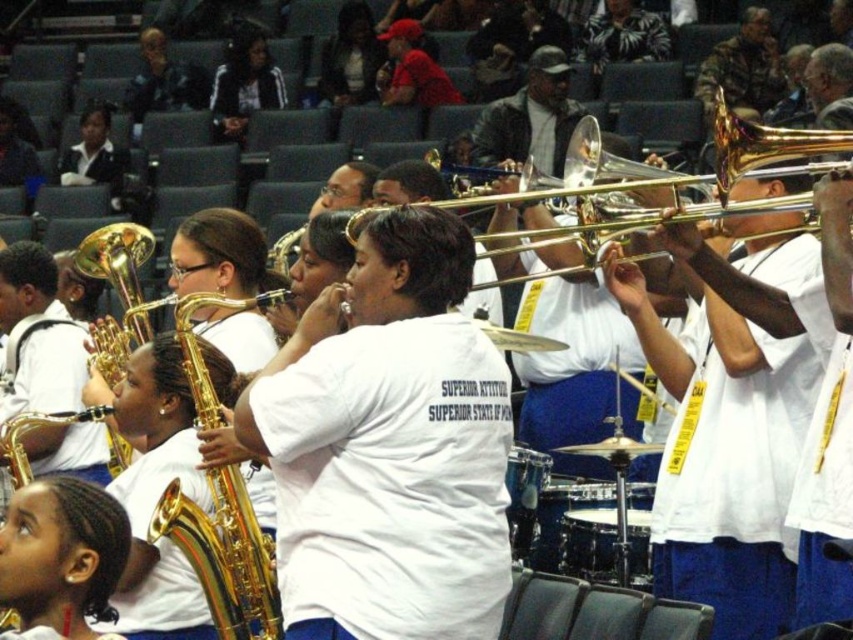
You are a photographer standing at the front of the stage where the school band is performing. You want to take a photo of the black jacket at upper left and the golden saxophone at lower right. How far apart are these two objects in the image?

The black jacket at upper left and the golden saxophone at lower right are 58.68 meters apart.

You are a photographer standing at the front of the stage where the school band is performing. You want to take a photo that includes both the point at coordinates point [202,538] and point [263,76]. Which of these points will appear closer to you in the final photo?

Point [202,538] is closer to the viewer than point [263,76], so it will appear closer in the photo.

You are a photographer trying to capture both the gold shiny saxophone at center and the gold shiny trumpet at upper right in a single frame. Given their positions and sizes, which instrument should you focus on first to ensure both fit in the shot?

The gold shiny saxophone at center is shorter than the gold shiny trumpet at upper right, so you should focus on the trumpet first as it is taller and might require more space to capture fully.